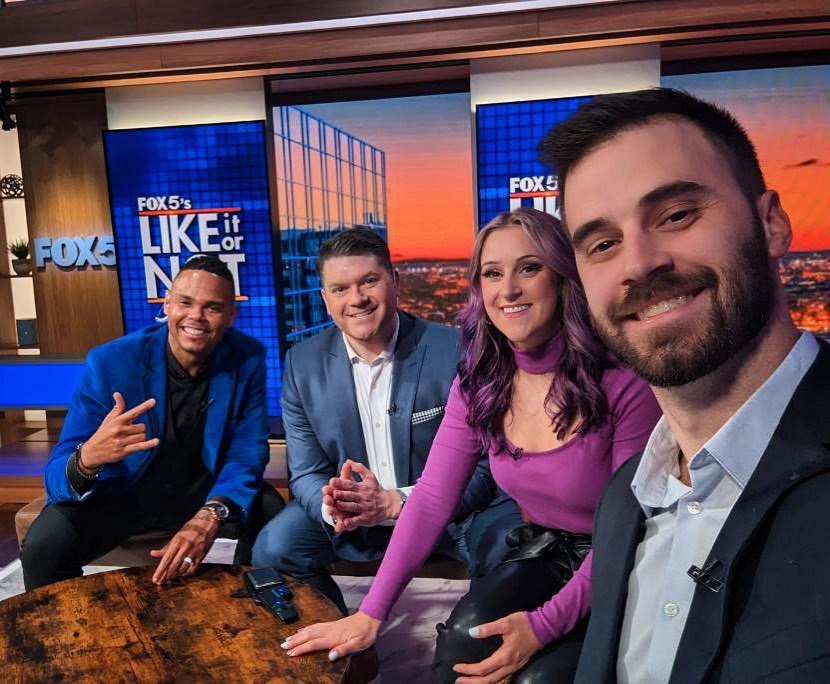
The width and height of the screenshot is (830, 684). Identify the location of wound wood coffee table. (182, 624).